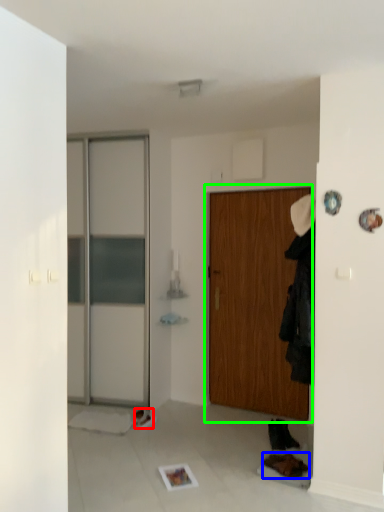
Question: Estimate the real-world distances between objects in this image. Which object is closer to shoe (highlighted by a red box), shoe (highlighted by a blue box) or door (highlighted by a green box)?

Choices:
 (A) shoe
 (B) door

Answer: (A)